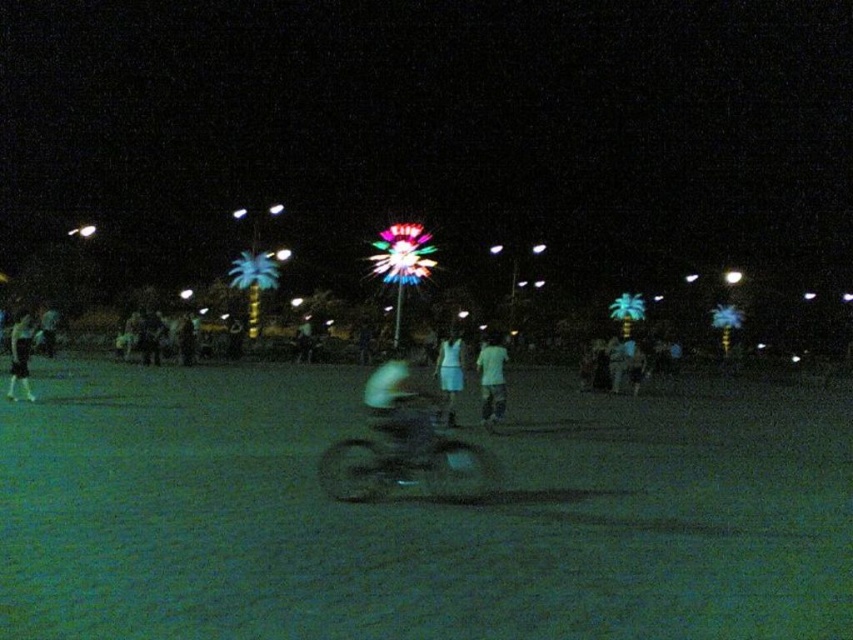
Question: Which of these objects is positioned farthest from the white matte shirt at center?

Choices:
 (A) dark blue jeans at left
 (B) white matte dress at center
 (C) dark matte motorcycle at center

Answer: (A)

Question: Can you confirm if white matte dress at center is thinner than dark blue jeans at left?

Choices:
 (A) no
 (B) yes

Answer: (B)

Question: Which point is closer to the camera?

Choices:
 (A) white matte dress at center
 (B) dark matte motorcycle at center
 (C) dark blue jeans at left

Answer: (B)

Question: Which point is farther to the camera?

Choices:
 (A) dark matte motorcycle at center
 (B) white matte shirt at center
 (C) white matte dress at center
 (D) dark blue jeans at left

Answer: (D)

Question: Is white matte dress at center to the right of dark blue jeans at left from the viewer's perspective?

Choices:
 (A) yes
 (B) no

Answer: (A)

Question: Does white matte shirt at center have a larger size compared to white matte dress at center?

Choices:
 (A) no
 (B) yes

Answer: (A)